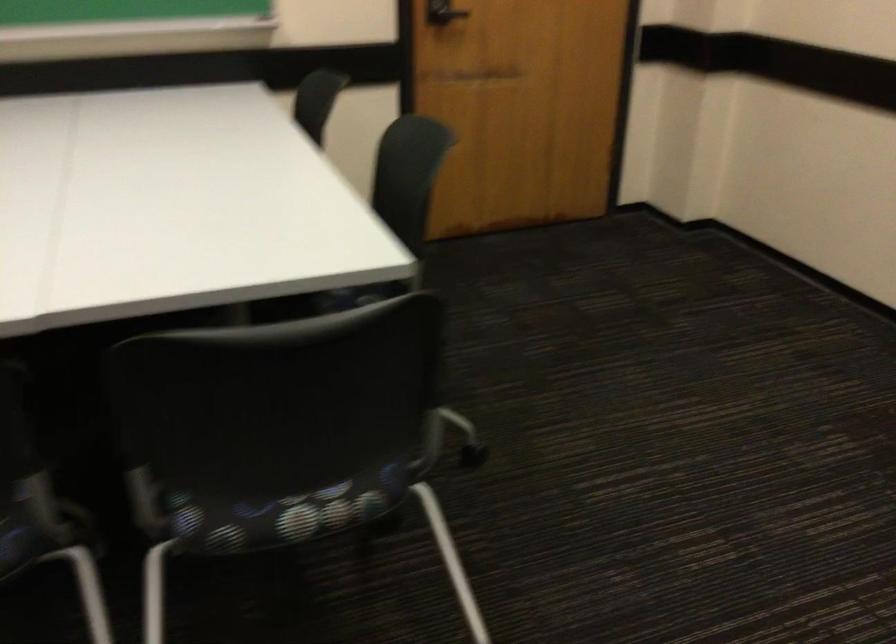
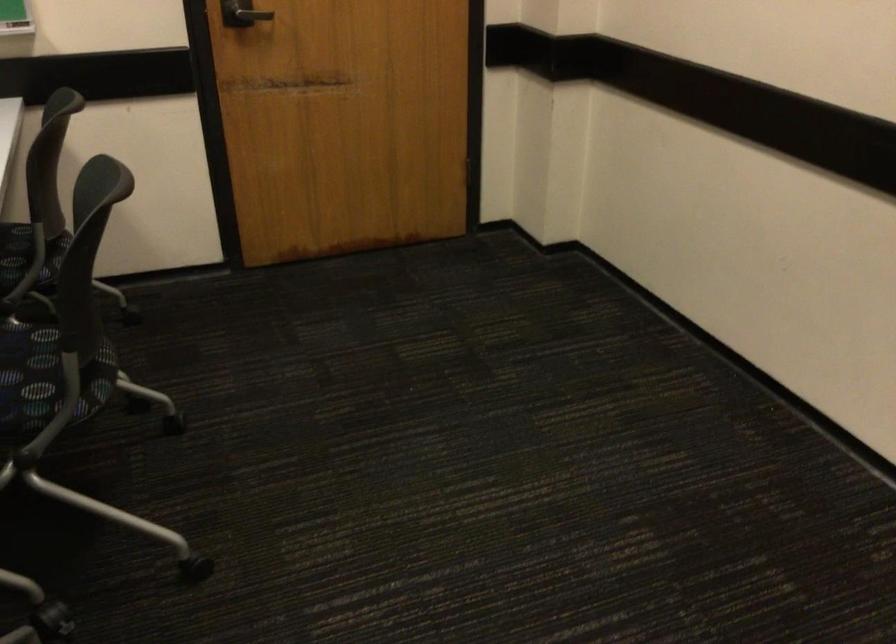
Question: The first image is from the beginning of the video and the second image is from the end. How did the camera likely rotate when shooting the video?

Choices:
 (A) Left
 (B) Right
 (C) Up
 (D) Down

Answer: (B)